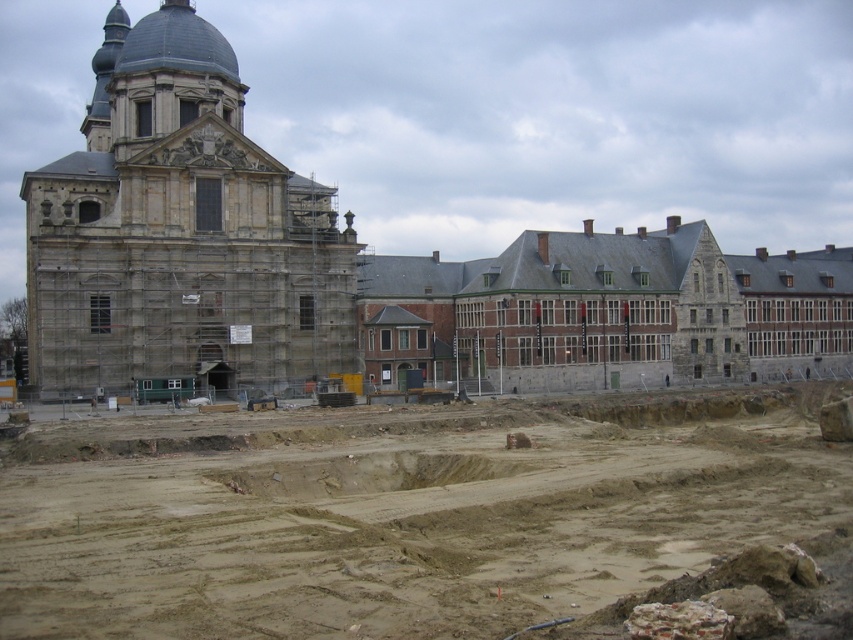
Question: Can you confirm if brown sandy dirt field at lower center is positioned to the right of stone church at left?

Choices:
 (A) no
 (B) yes

Answer: (B)

Question: Among these points, which one is nearest to the camera?

Choices:
 (A) (310, 548)
 (B) (140, 376)

Answer: (A)

Question: Can you confirm if brown sandy dirt field at lower center is positioned above stone church at left?

Choices:
 (A) no
 (B) yes

Answer: (A)

Question: Does brown sandy dirt field at lower center appear on the right side of stone church at left?

Choices:
 (A) no
 (B) yes

Answer: (B)